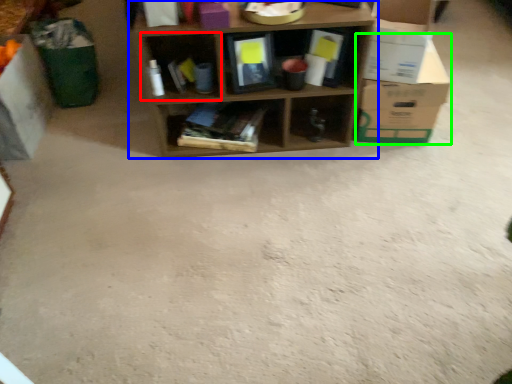
Question: Considering the real-world distances, which object is farthest from shelf (highlighted by a red box)? shelf (highlighted by a blue box) or cardboard box (highlighted by a green box)?

Choices:
 (A) shelf
 (B) cardboard box

Answer: (B)